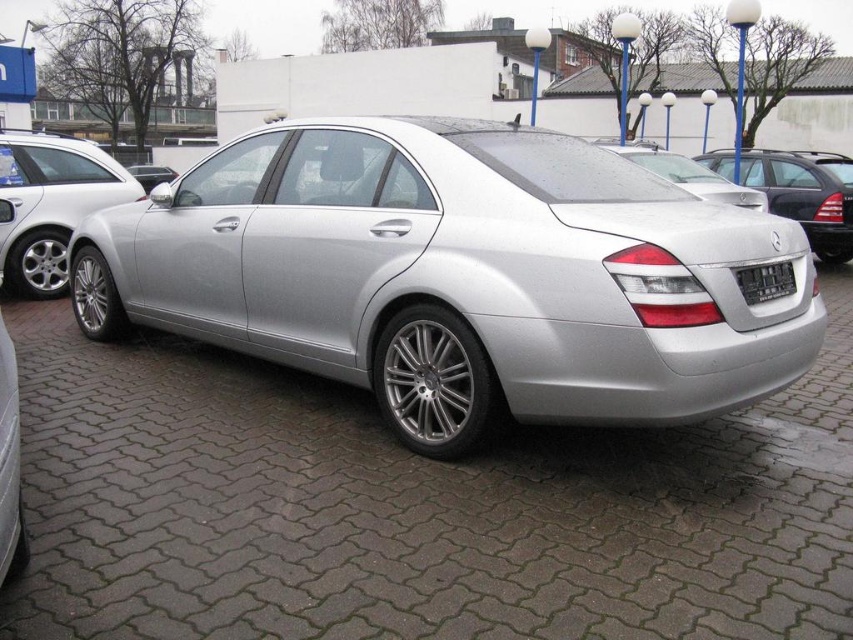
You are a parking attendant and need to guide a driver to park their car in the spot where the silver metallic sedan at left is currently parked. However, the driver is approaching from the right side of the black plastic license plate at rear. Which direction should they turn to align with the parking spot?

The silver metallic sedan at left is positioned on the left side of the black plastic license plate at rear. Therefore, the driver should turn left to align with the parking spot.

You are a parking attendant and need to guide a driver to park their car between the silver metallic sedan at left and the satin silver car at center. Is there enough space between them to fit a standard compact car?

The silver metallic sedan at left is positioned on the left side of the satin silver car at center, so there is space between them. A standard compact car can fit between the silver metallic sedan at left and the satin silver car at center.